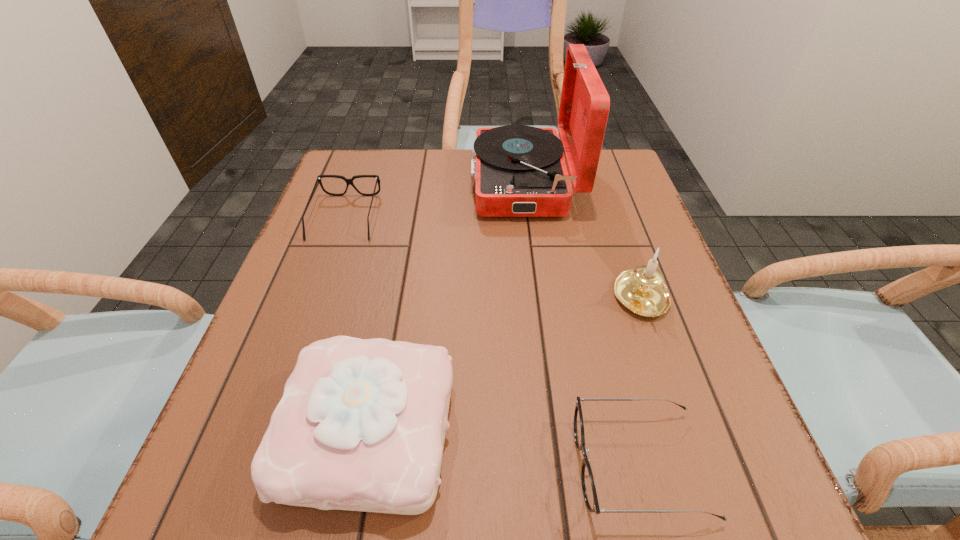
Find the location of a particular element. free space located with the lenses facing outward on the farther spectacles is located at coordinates (331, 258).

Where is `vacant space located through the lenses of the nearer spectacles`? The height and width of the screenshot is (540, 960). vacant space located through the lenses of the nearer spectacles is located at coordinates (506, 464).

Image resolution: width=960 pixels, height=540 pixels. In order to click on vacant space situated 0.390m through the lenses of the nearer spectacles in this screenshot , I will do `click(301, 464)`.

Identify the location of free region located through the lenses of the nearer spectacles. (535, 464).

Find the location of a particular element. phonograph_record that is at the far edge is located at coordinates (519, 171).

Locate an element on the screen. The width and height of the screenshot is (960, 540). spectacles that is at the far edge is located at coordinates (348, 181).

Where is `cake that is at the near edge`? The width and height of the screenshot is (960, 540). cake that is at the near edge is located at coordinates (361, 425).

This screenshot has height=540, width=960. What are the coordinates of `spectacles present at the near edge` in the screenshot? It's located at (588, 486).

You are a GUI agent. You are given a task and a screenshot of the screen. Output one action in this format:
    pyautogui.click(x=<x>, y=<y>)
    Task: Click on the cake that is at the left edge
    The width and height of the screenshot is (960, 540).
    Given the screenshot: What is the action you would take?
    click(x=361, y=425)

I want to click on spectacles that is at the left edge, so click(x=348, y=181).